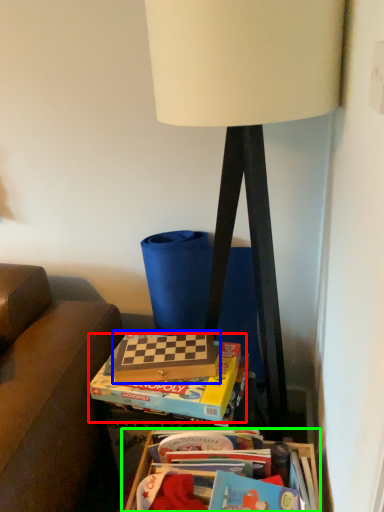
Question: Considering the real-world distances, which object is closest to paperback book (highlighted by a red box)? paperback book (highlighted by a blue box) or table (highlighted by a green box).

Choices:
 (A) paperback book
 (B) table

Answer: (A)